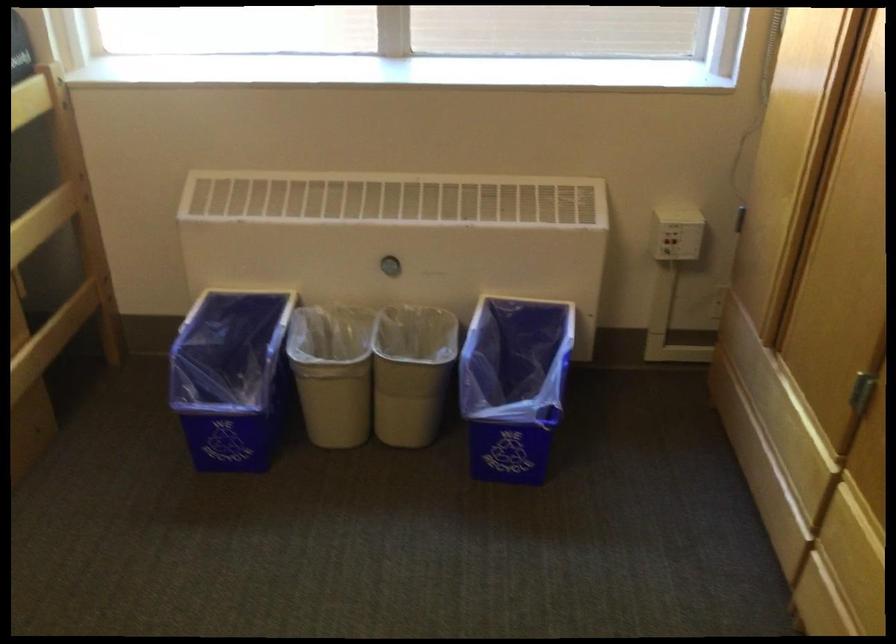
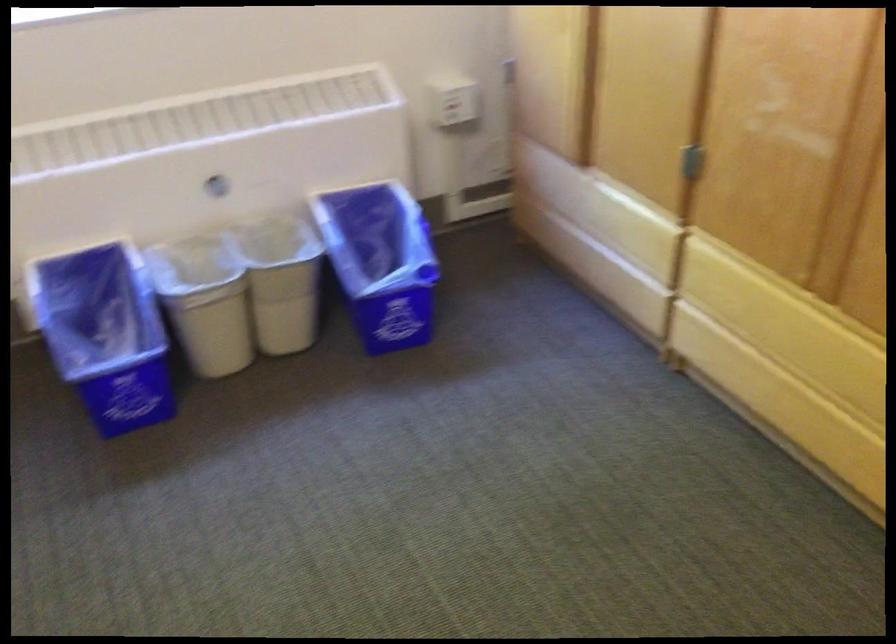
Where in the second image is the point corresponding to point (670, 234) from the first image?

(452, 100)